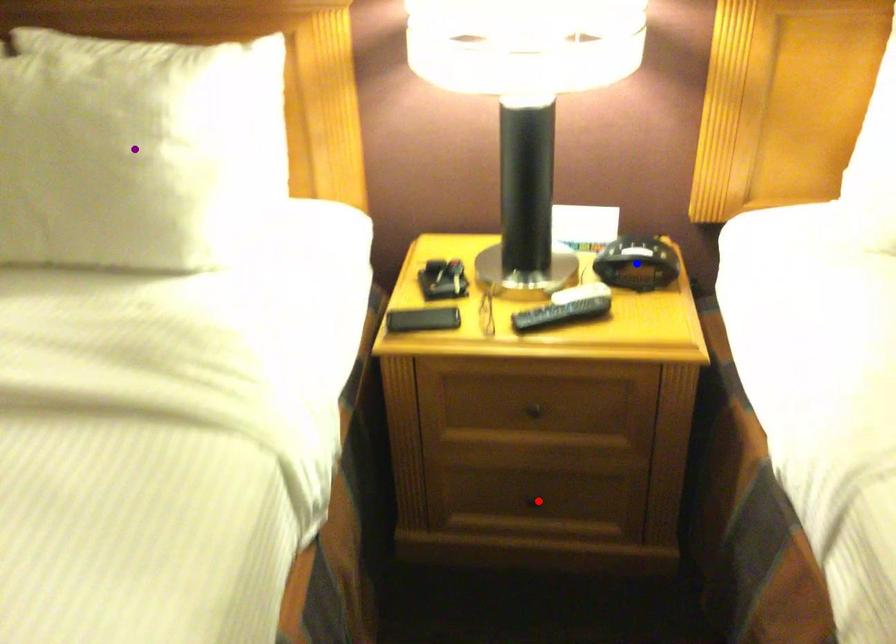
Order these from nearest to farthest:
1. purple point
2. red point
3. blue point

purple point → blue point → red point